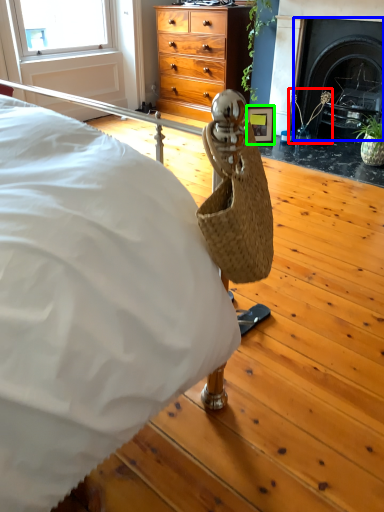
Question: Based on their relative distances, which object is farther from plant (highlighted by a red box)? Choose from fireplace (highlighted by a blue box) and picture frame (highlighted by a green box).

Choices:
 (A) fireplace
 (B) picture frame

Answer: (B)